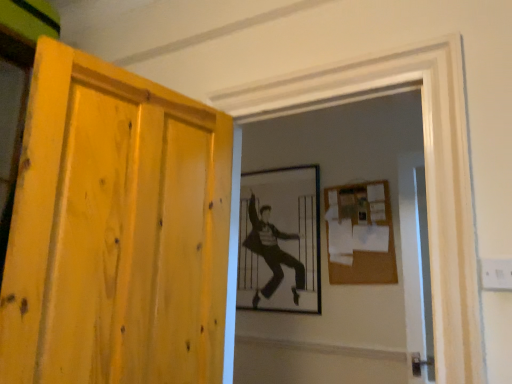
This screenshot has height=384, width=512. I want to click on empty space that is ontop of black and white photograph of a man at center (from a real-world perspective), so click(281, 167).